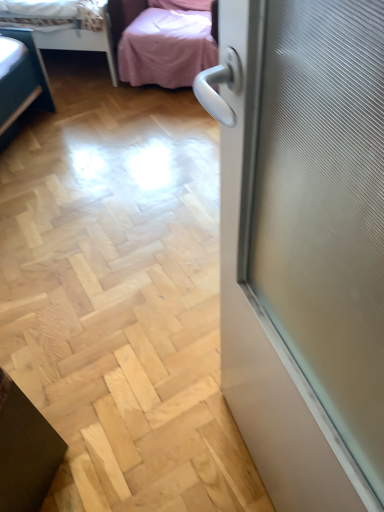
Where is `free space in front of pink fabric studio couch at upper center`? free space in front of pink fabric studio couch at upper center is located at coordinates (134, 130).